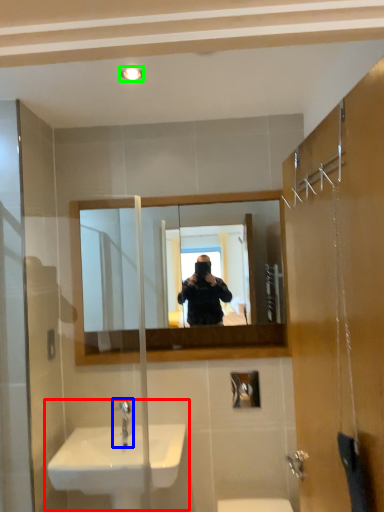
Question: Which object is positioned closest to sink (highlighted by a red box)? Select from tap (highlighted by a blue box) and light fixture (highlighted by a green box).

Choices:
 (A) tap
 (B) light fixture

Answer: (A)